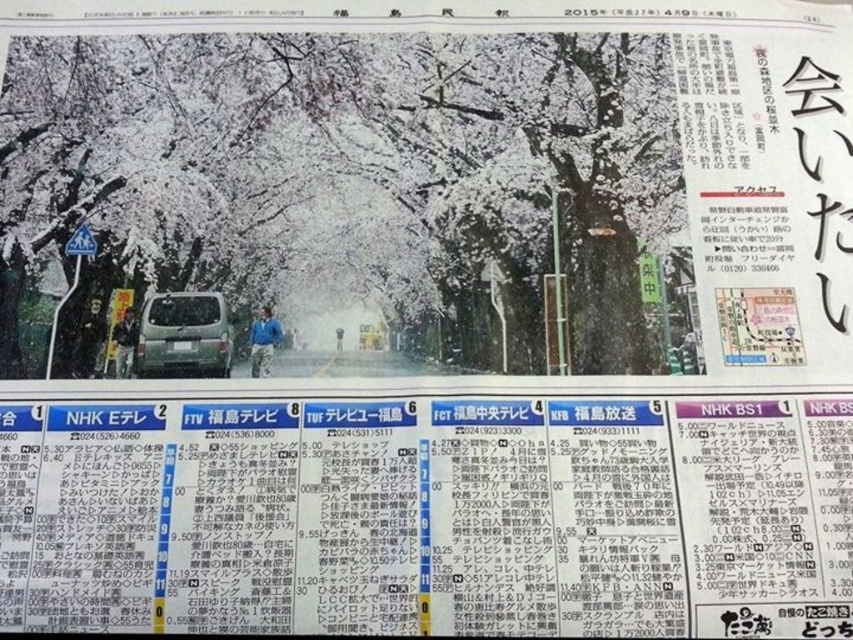
Question: Which object is closer to the camera taking this photo?

Choices:
 (A) white paper at bottom
 (B) matte silver van at center

Answer: (A)

Question: Which of the following is the farthest from the observer?

Choices:
 (A) (22, 554)
 (B) (204, 305)

Answer: (B)

Question: Does white paper at bottom appear on the right side of matte silver van at center?

Choices:
 (A) no
 (B) yes

Answer: (B)

Question: Does white paper at bottom appear on the left side of matte silver van at center?

Choices:
 (A) yes
 (B) no

Answer: (B)

Question: Does white paper at bottom have a larger size compared to matte silver van at center?

Choices:
 (A) no
 (B) yes

Answer: (B)